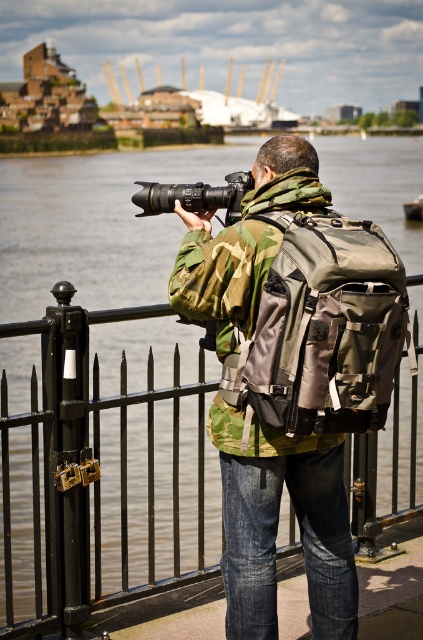
Who is lower down, camo fabric jacket at center or matte black camera at center?

camo fabric jacket at center is lower down.

Which is in front, point (280, 180) or point (222, 188)?

Point (280, 180)

Find the location of a particular element. Image resolution: width=423 pixels, height=640 pixels. camo fabric jacket at center is located at coordinates (291, 376).

Who is higher up, camo fabric jacket at center or black metal fence at lower center?

Positioned higher is camo fabric jacket at center.

Is point (279, 257) closer to viewer compared to point (184, 580)?

Yes, it is.

Find the location of a particular element. camo fabric jacket at center is located at coordinates (291, 376).

Which is below, camouflage fabric backpack at center or matte black camera at center?

Positioned lower is camouflage fabric backpack at center.

Does camouflage fabric backpack at center lie behind matte black camera at center?

No, camouflage fabric backpack at center is in front of matte black camera at center.

Which is in front, point (379, 248) or point (219, 202)?

Point (379, 248) is in front.

Find the location of a particular element. Image resolution: width=423 pixels, height=640 pixels. camouflage fabric backpack at center is located at coordinates (326, 326).